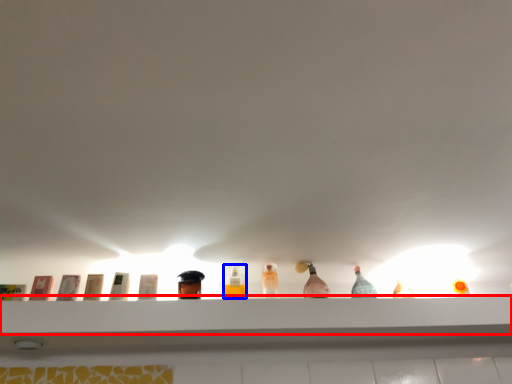
Question: Which object appears closest to the camera in this image, shelf (highlighted by a red box) or bottle (highlighted by a blue box)?

Choices:
 (A) shelf
 (B) bottle

Answer: (A)